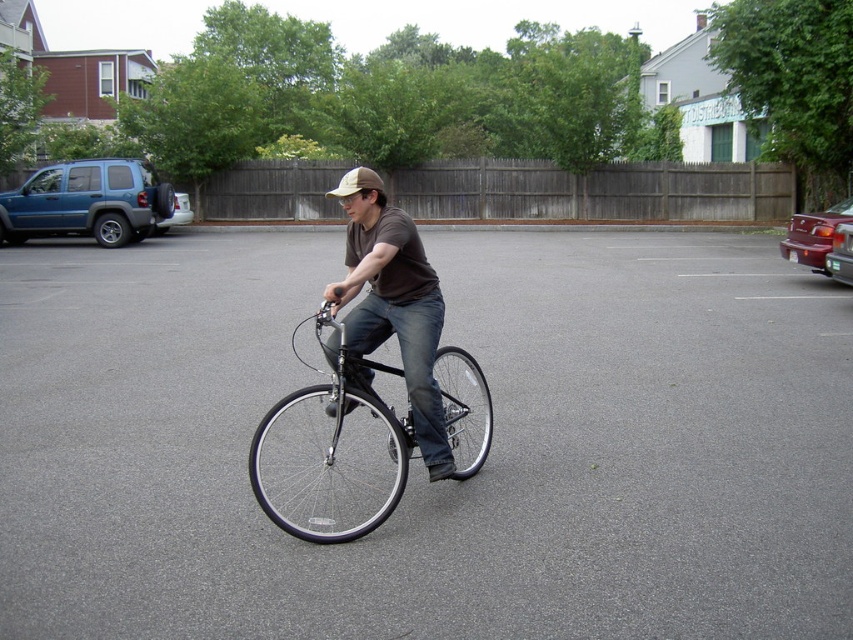
You are a delivery driver who needs to park your matte blue suv at left in the gray asphalt parking lot at center. Can you fit your SUV in the parking lot based on their sizes?

The gray asphalt parking lot at center is larger in size than the matte blue suv at left, so yes, the matte blue suv at left can fit in the gray asphalt parking lot at center.

You are a delivery driver who needs to park your vehicle in the gray asphalt parking lot at center. The matte blue suv at left is blocking your path. Can you drive around it to reach the parking lot?

The gray asphalt parking lot at center is to the right of the matte blue suv at left, so you can drive around the matte blue suv at left on its right side to reach the gray asphalt parking lot at center.